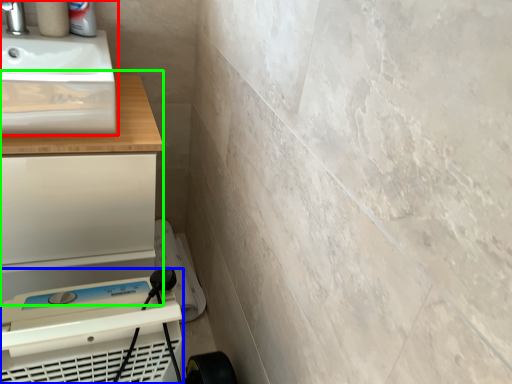
Question: Which object is the farthest from sink (highlighted by a red box)? Choose among these: appliance (highlighted by a blue box) or counter (highlighted by a green box).

Choices:
 (A) appliance
 (B) counter

Answer: (A)